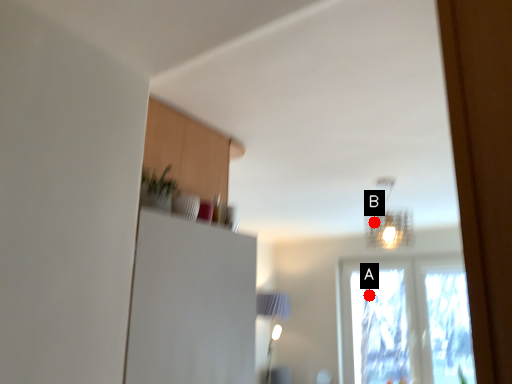
Question: Two points are circled on the image, labeled by A and B beside each circle. Among these points, which one is farthest from the camera?

Choices:
 (A) A is further
 (B) B is further

Answer: (A)